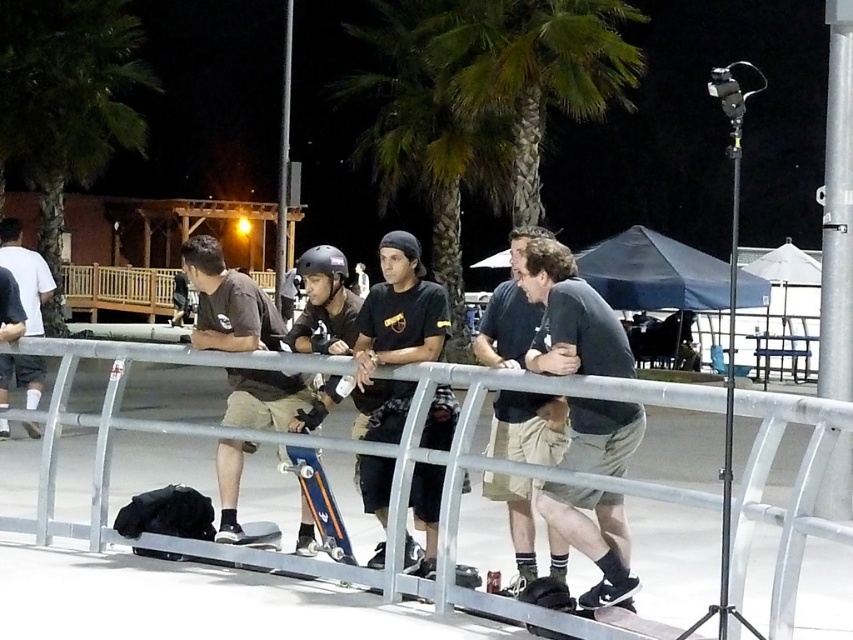
You are standing at the skateboarding event and want to take a photo of the point at coordinates (123,54). Your camera has a maximum focus range of 20 meters. Will the camera be able to focus on that point?

The distance of point (123,54) is 20.65 meters from the camera, which exceeds the camera maximum focus range of 20 meters. The camera will not be able to focus on that point.

Based on the photo, you are a photographer setting up for a night shoot at this skateboarding event. You want to frame a shot that includes both the green leafy palm tree at upper left and the green leafy palm tree at upper center. Which palm tree should you adjust your camera angle to focus on if you want to capture the wider tree in the frame?

The green leafy palm tree at upper center is wider than the green leafy palm tree at upper left, so you should focus on the green leafy palm tree at upper center to capture the wider tree in the frame.

You are a photographer trying to capture a photo of the matte black helmet at center without the green leafy palm tree at upper left blocking the view. Based on their heights, can you position yourself lower to the ground to avoid the palm tree blocking the helmet?

The green leafy palm tree at upper left is taller than the matte black helmet at center, so positioning yourself lower to the ground might help avoid the palm tree blocking the view of the helmet.